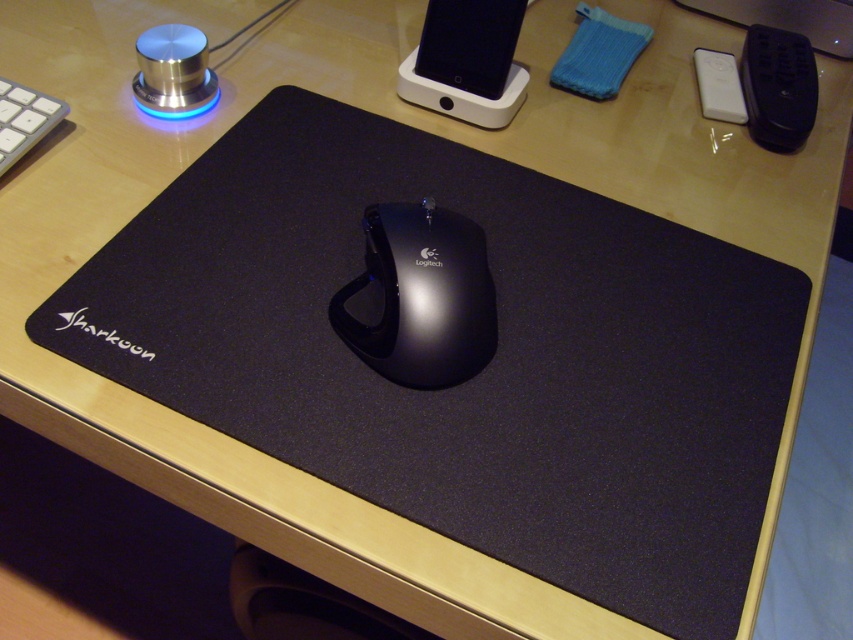
Is black glossy mouse at center wider than white plastic keyboard at upper left?

Yes, black glossy mouse at center is wider than white plastic keyboard at upper left.

At what (x,y) coordinates should I click in order to perform the action: click on black glossy mouse at center. Please return your answer as a coordinate pair (x, y). Looking at the image, I should click on (422, 296).

Where is `black glossy mouse at center`? This screenshot has width=853, height=640. black glossy mouse at center is located at coordinates (422, 296).